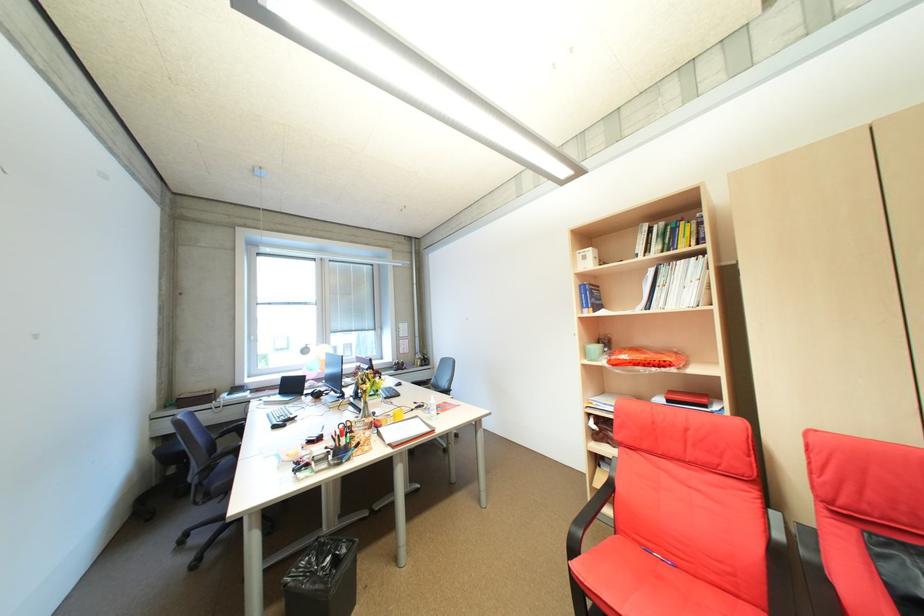
At what (x,y) coordinates should I click in order to perform the action: click on red chair sitting surface. Please return your answer as a coordinate pair (x, y). The height and width of the screenshot is (616, 924). Looking at the image, I should click on (659, 584).